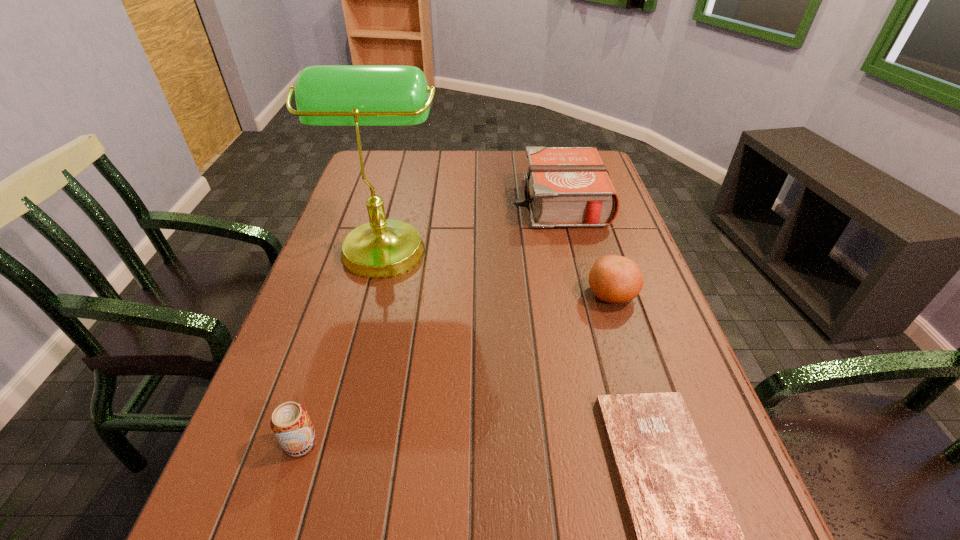
The width and height of the screenshot is (960, 540). Identify the location of empty space between the second tallest object and the beer can. (430, 322).

Identify the location of vacant point located between the beer can and the second tallest object. (430, 322).

Locate an element on the screen. vacant space that is in between the lamp and the beer can is located at coordinates (344, 344).

Locate an element on the screen. vacant area that lies between the clementine and the taller Bible is located at coordinates (586, 248).

Where is `empty space that is in between the lamp and the beer can`? empty space that is in between the lamp and the beer can is located at coordinates (344, 344).

Where is `object that is the second closest to the clementine`? Image resolution: width=960 pixels, height=540 pixels. object that is the second closest to the clementine is located at coordinates (687, 539).

Find the location of a particular element. the closest object to the tallest object is located at coordinates click(565, 186).

This screenshot has height=540, width=960. I want to click on free space that satisfies the following two spatial constraints: 1. on the desk next to the clementine; 2. on the left side of the tallest object, so click(x=372, y=294).

Where is `free space that satisfies the following two spatial constraints: 1. on the back side of the beer can; 2. on the left side of the clementine`? free space that satisfies the following two spatial constraints: 1. on the back side of the beer can; 2. on the left side of the clementine is located at coordinates (348, 294).